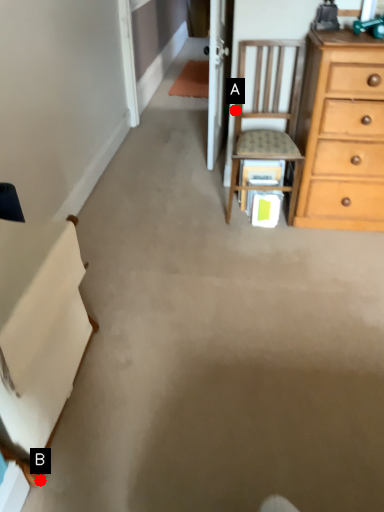
Question: Two points are circled on the image, labeled by A and B beside each circle. Which point is further to the camera?

Choices:
 (A) A is further
 (B) B is further

Answer: (A)